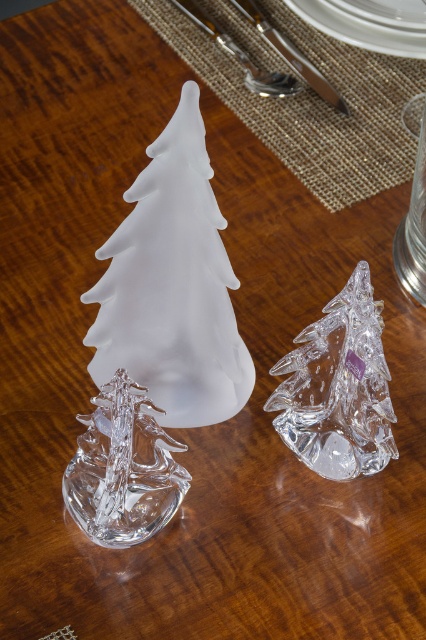
Question: Which point is closer to the camera?

Choices:
 (A) satin silver knife at upper center
 (B) frosted glass tree at center
 (C) polished silver knife at upper center

Answer: (B)

Question: Is frosted glass tree at center to the left of satin silver knife at upper center from the viewer's perspective?

Choices:
 (A) yes
 (B) no

Answer: (A)

Question: Which point appears farthest from the camera in this image?

Choices:
 (A) (199, 172)
 (B) (293, 68)

Answer: (B)

Question: Estimate the real-world distances between objects in this image. Which object is farther from the frosted glass tree at center?

Choices:
 (A) transparent glass tree at center
 (B) satin silver knife at upper center
 (C) polished silver knife at upper center

Answer: (C)

Question: Does frosted glass tree at center appear under transparent glass tree at center?

Choices:
 (A) yes
 (B) no

Answer: (B)

Question: Is transparent glass tree at center positioned behind polished silver knife at upper center?

Choices:
 (A) no
 (B) yes

Answer: (A)